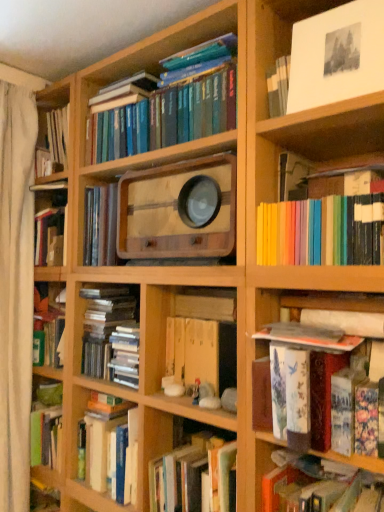
Question: In which direction should I rotate to look at hardcover book at center, the second book ordered from the bottom?

Choices:
 (A) right
 (B) left

Answer: (A)

Question: From a real-world perspective, is hardcover book at lower right, acting as the first book starting from the bottom, located beneath blue hardcover books at upper center, the 5th book when ordered from bottom to top?

Choices:
 (A) yes
 (B) no

Answer: (A)

Question: Can you confirm if hardcover book at lower right, acting as the first book starting from the bottom, is smaller than blue hardcover books at upper center, the 5th book when ordered from bottom to top?

Choices:
 (A) no
 (B) yes

Answer: (B)

Question: Could you tell me if hardcover book at lower right, which is the 5th book from top to bottom, is turned towards blue hardcover books at upper center, which is the 1th book in top-to-bottom order?

Choices:
 (A) yes
 (B) no

Answer: (B)

Question: Does hardcover book at lower right, which is the 5th book from top to bottom, have a greater width compared to blue hardcover books at upper center, which is the 1th book in top-to-bottom order?

Choices:
 (A) yes
 (B) no

Answer: (A)

Question: Is blue hardcover books at upper center, which is the 1th book in top-to-bottom order, located within hardcover book at lower right, which is the 5th book from top to bottom?

Choices:
 (A) yes
 (B) no

Answer: (B)

Question: Can you confirm if hardcover book at lower right, which is the 5th book from top to bottom, is thinner than blue hardcover books at upper center, which is the 1th book in top-to-bottom order?

Choices:
 (A) yes
 (B) no

Answer: (B)

Question: Considering the relative sizes of hardcover book at lower right, which is the 5th book from top to bottom, and white fabric curtain at left in the image provided, is hardcover book at lower right, which is the 5th book from top to bottom, smaller than white fabric curtain at left?

Choices:
 (A) no
 (B) yes

Answer: (B)

Question: Does hardcover book at lower right, which is the 5th book from top to bottom, have a larger size compared to white fabric curtain at left?

Choices:
 (A) yes
 (B) no

Answer: (B)

Question: Is hardcover book at lower right, acting as the first book starting from the bottom, aimed at white fabric curtain at left?

Choices:
 (A) no
 (B) yes

Answer: (A)

Question: Is hardcover book at lower right, acting as the first book starting from the bottom, turned away from white fabric curtain at left?

Choices:
 (A) yes
 (B) no

Answer: (B)

Question: Considering the relative positions of hardcover book at lower right, acting as the first book starting from the bottom, and white fabric curtain at left in the image provided, is hardcover book at lower right, acting as the first book starting from the bottom, behind white fabric curtain at left?

Choices:
 (A) yes
 (B) no

Answer: (B)

Question: Does hardcover book at lower right, which is the 5th book from top to bottom, have a greater height compared to white fabric curtain at left?

Choices:
 (A) no
 (B) yes

Answer: (A)

Question: Could you tell me if hardcover book at lower right, acting as the first book starting from the bottom, is turned towards white paper at upper right?

Choices:
 (A) no
 (B) yes

Answer: (A)